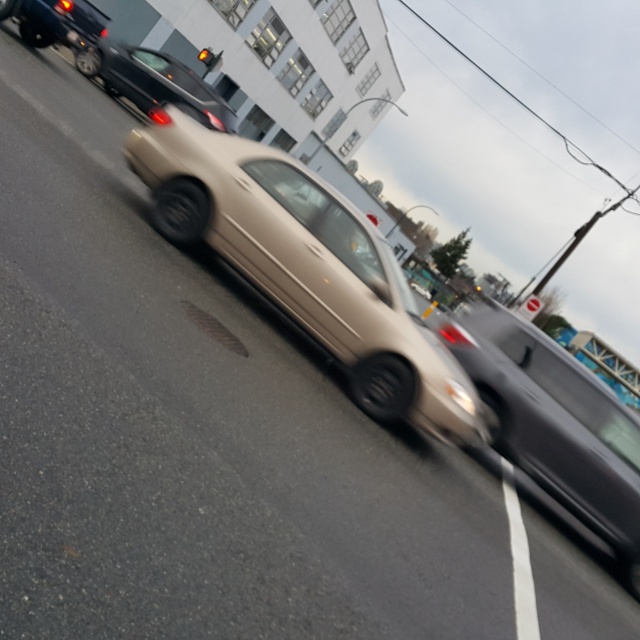
Question: Which point appears farthest from the camera in this image?

Choices:
 (A) (627, 472)
 (B) (193, 77)

Answer: (B)

Question: Does satin beige sedan at center appear on the left side of shiny black car at upper left?

Choices:
 (A) yes
 (B) no

Answer: (B)

Question: Can you confirm if matte silver sedan at center is positioned to the right of amber glass traffic light at upper center?

Choices:
 (A) yes
 (B) no

Answer: (A)

Question: Which object is farther from the camera taking this photo?

Choices:
 (A) matte silver sedan at center
 (B) shiny black sedan at upper center

Answer: (B)

Question: Which of the following is the farthest from the observer?

Choices:
 (A) tap(524, 433)
 (B) tap(384, 301)
 (C) tap(209, 65)
 (D) tap(24, 38)

Answer: (C)

Question: Is satin beige sedan at center bigger than shiny black sedan at upper center?

Choices:
 (A) no
 (B) yes

Answer: (B)